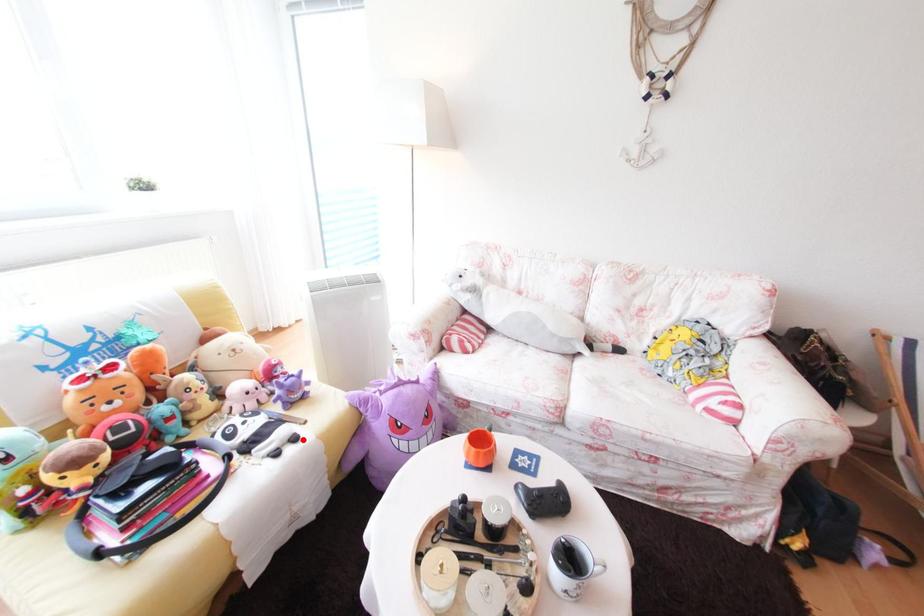
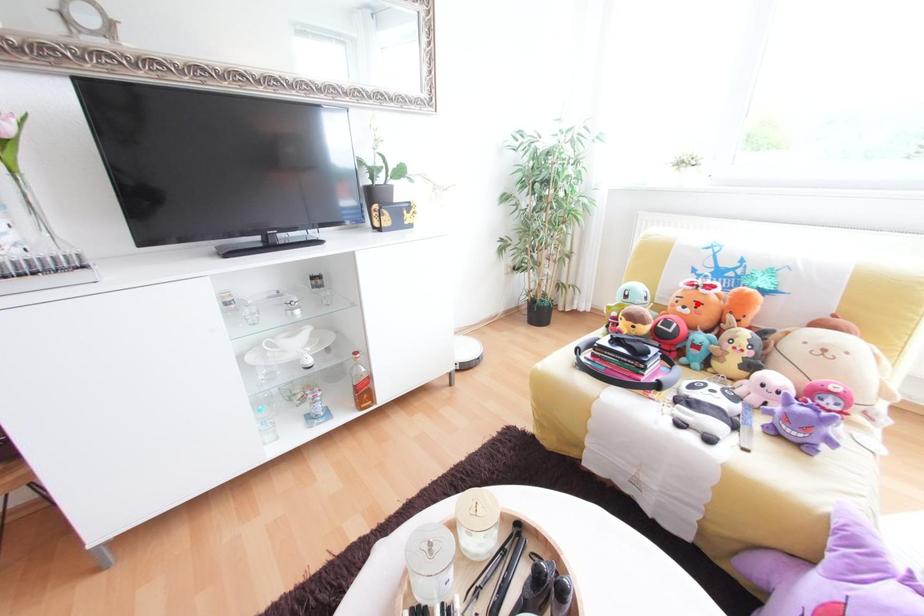
I am providing you with two images of the same scene from different viewpoints. A red point is marked on the first image and another point is marked on the second image. Is the red point in image1 aligned with the point shown in image2?

No